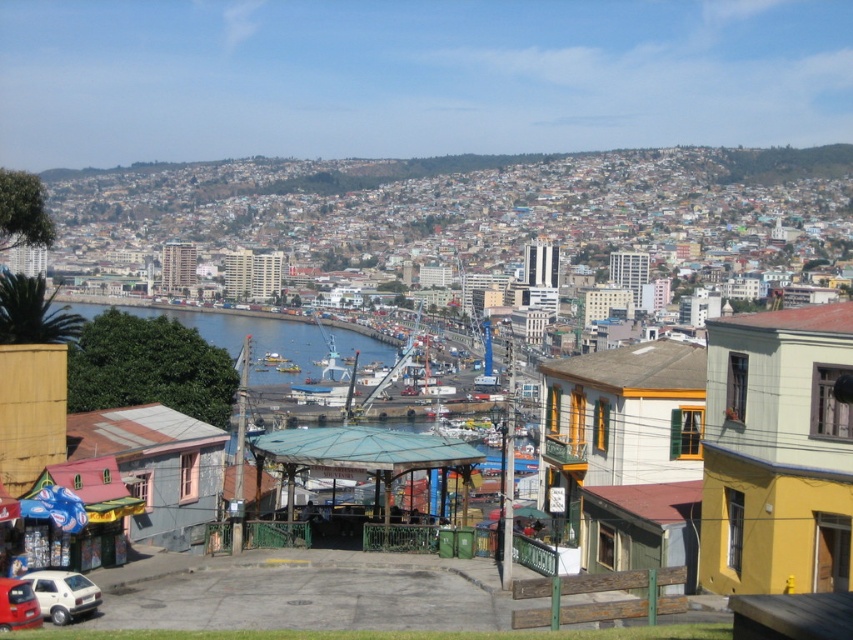
You are standing at the center of the paved pathway leading to the green roofed structure. You need to park your white matte car at lower left in a spot that is exactly 0.1 meters to the east of its current position. Is this possible given its current location?

The white matte car at lower left is located at point (62, 595). Moving it 0.1 meters east would require space to the east. Since the scene includes a busy harbor with boats and industrial equipment nearby, there might not be enough space. However, without specific spatial constraints, it is theoretically possible if the area east is clear. But based on the description, the exact feasibility isn

Based on the photo, you are standing on the paved pathway leading to the green roofed structure. You see the blue water at center and the white matte car at lower left. Which object is located to the left of the other?

The blue water at center is positioned on the left side of white matte car at lower left, so the blue water at center is to the left of the white matte car at lower left.